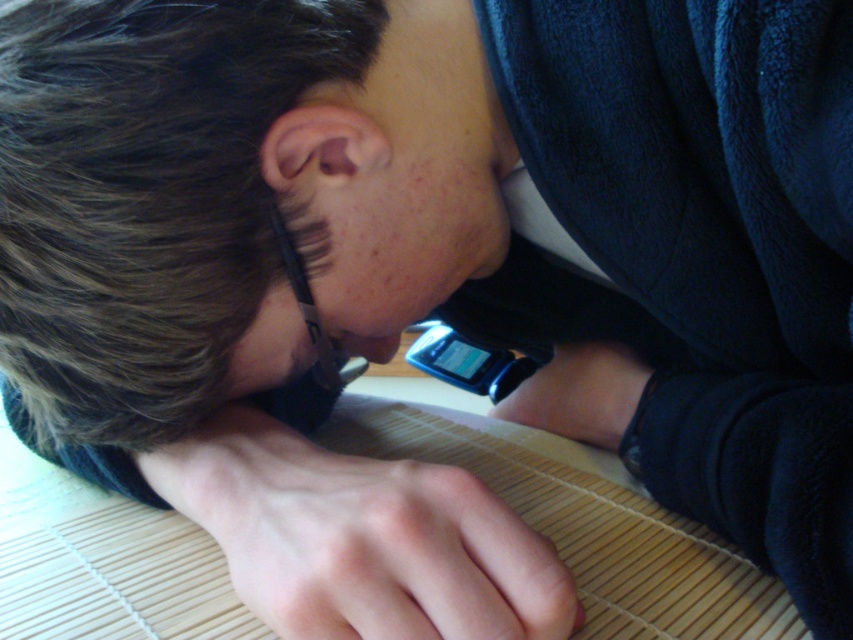
Locate an element on the screen. dark blue fleece sweatshirt at upper right is located at coordinates (701, 252).

Can you confirm if dark blue fleece sweatshirt at upper right is wider than smooth skin hand at lower center?

No, dark blue fleece sweatshirt at upper right is not wider than smooth skin hand at lower center.

Find the location of a particular element. This screenshot has width=853, height=640. dark blue fleece sweatshirt at upper right is located at coordinates (701, 252).

Between dark blue fleece sweatshirt at upper right and satin black watch at lower center, which one has more height?

With more height is dark blue fleece sweatshirt at upper right.

Does dark blue fleece sweatshirt at upper right have a larger size compared to satin black watch at lower center?

Yes.

The image size is (853, 640). Identify the location of dark blue fleece sweatshirt at upper right. (701, 252).

Is smooth skin hand at lower center to the left of satin black watch at lower center from the viewer's perspective?

Correct, you'll find smooth skin hand at lower center to the left of satin black watch at lower center.

Is smooth skin hand at lower center to the right of satin black watch at lower center from the viewer's perspective?

Incorrect, smooth skin hand at lower center is not on the right side of satin black watch at lower center.

Who is more forward, (273, 454) or (631, 397)?

Positioned in front is point (273, 454).

Find the location of `smooth skin hand at lower center`. smooth skin hand at lower center is located at coordinates (361, 540).